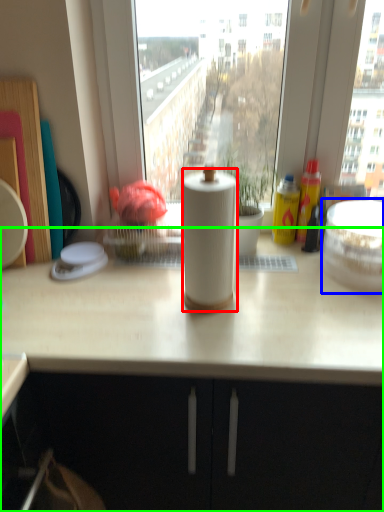
Question: Considering the real-world distances, which object is farthest from paper towel (highlighted by a red box)? appliance (highlighted by a blue box) or countertop (highlighted by a green box)?

Choices:
 (A) appliance
 (B) countertop

Answer: (A)